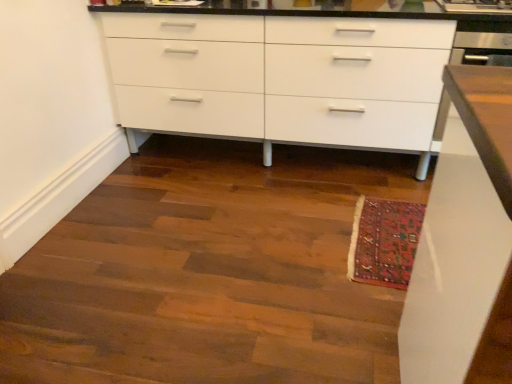
Question: From the image's perspective, would you say white glossy cabinet at center is positioned over wooden floor at lower center?

Choices:
 (A) no
 (B) yes

Answer: (B)

Question: Is white glossy cabinet at center positioned in front of wooden floor at lower center?

Choices:
 (A) yes
 (B) no

Answer: (B)

Question: Is white glossy cabinet at center next to wooden floor at lower center and touching it?

Choices:
 (A) no
 (B) yes

Answer: (A)

Question: Is white glossy cabinet at center wider than wooden floor at lower center?

Choices:
 (A) no
 (B) yes

Answer: (A)

Question: Does white glossy cabinet at center have a smaller size compared to wooden floor at lower center?

Choices:
 (A) no
 (B) yes

Answer: (A)

Question: Is carpeted mat at lower right taller or shorter than white glossy cabinet at center?

Choices:
 (A) short
 (B) tall

Answer: (A)

Question: Do you think carpeted mat at lower right is within white glossy cabinet at center, or outside of it?

Choices:
 (A) inside
 (B) outside

Answer: (B)

Question: Would you say carpeted mat at lower right is to the left or to the right of white glossy cabinet at center in the picture?

Choices:
 (A) right
 (B) left

Answer: (A)

Question: From the image's perspective, is carpeted mat at lower right located above or below white glossy cabinet at center?

Choices:
 (A) below
 (B) above

Answer: (A)

Question: From the image's perspective, is carpeted mat at lower right positioned above or below wooden floor at lower center?

Choices:
 (A) below
 (B) above

Answer: (A)

Question: From a real-world perspective, is carpeted mat at lower right above or below wooden floor at lower center?

Choices:
 (A) below
 (B) above

Answer: (A)

Question: In terms of height, does carpeted mat at lower right look taller or shorter compared to wooden floor at lower center?

Choices:
 (A) tall
 (B) short

Answer: (A)

Question: Looking at their shapes, would you say carpeted mat at lower right is wider or thinner than wooden floor at lower center?

Choices:
 (A) thin
 (B) wide

Answer: (A)

Question: Does point (117, 379) appear closer or farther from the camera than point (394, 281)?

Choices:
 (A) farther
 (B) closer

Answer: (B)

Question: In the image, is wooden floor at lower center on the left side or the right side of carpeted mat at lower right?

Choices:
 (A) left
 (B) right

Answer: (A)